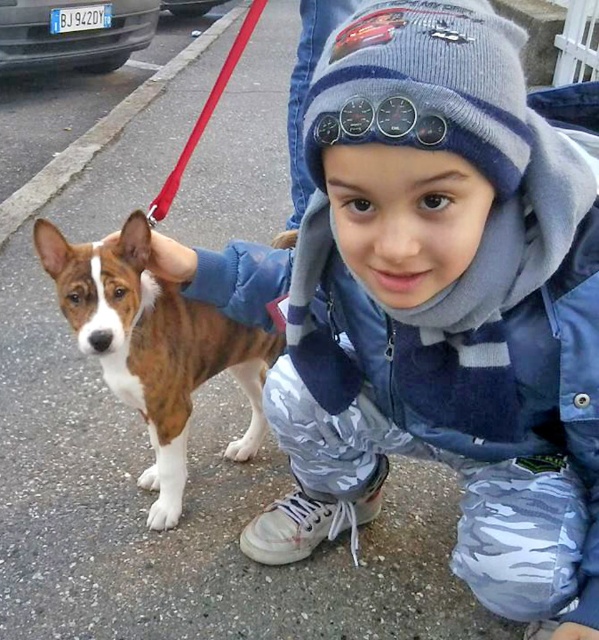
Question: Which point appears farthest from the camera in this image?

Choices:
 (A) (231, 68)
 (B) (140, 349)

Answer: (A)

Question: Is brown brindle fur at center to the right of red nylon leash at upper center from the viewer's perspective?

Choices:
 (A) yes
 (B) no

Answer: (A)

Question: Which object appears closest to the camera in this image?

Choices:
 (A) brown brindle fur at center
 (B) red nylon leash at upper center

Answer: (A)

Question: Does brown brindle fur at center appear under red nylon leash at upper center?

Choices:
 (A) no
 (B) yes

Answer: (B)

Question: Is brown brindle fur at center wider than red nylon leash at upper center?

Choices:
 (A) no
 (B) yes

Answer: (A)

Question: Among these points, which one is farthest from the camera?

Choices:
 (A) (159, 198)
 (B) (162, 358)

Answer: (B)